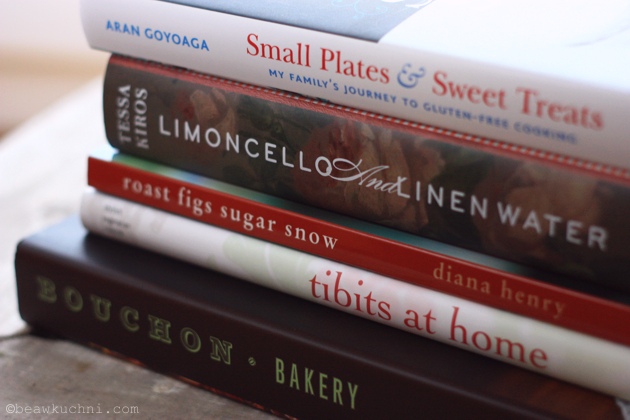
Identify the location of books. The image size is (630, 420). (478, 73), (433, 149), (413, 254), (386, 314), (368, 372).